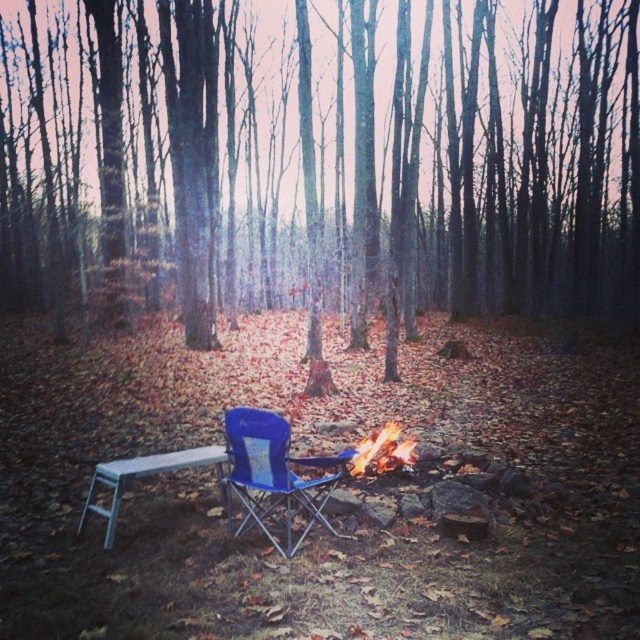
Question: Can you confirm if blue mesh folding chair at center is positioned to the right of flaming wood fire at center?

Choices:
 (A) no
 (B) yes

Answer: (A)

Question: Based on their relative distances, which object is farther from the smooth bark tree at center?

Choices:
 (A) flaming wood fire at center
 (B) blue mesh folding chair at center
 (C) metallic silver stool at lower left

Answer: (A)

Question: Which object is closer to the camera taking this photo?

Choices:
 (A) flaming wood fire at center
 (B) metallic silver stool at lower left
 (C) blue mesh folding chair at center
 (D) smooth bark tree at center

Answer: (C)

Question: Which is farther from the smooth bark tree at center?

Choices:
 (A) blue mesh folding chair at center
 (B) metallic silver stool at lower left

Answer: (B)

Question: Can you confirm if smooth bark tree at center is positioned to the right of flaming wood fire at center?

Choices:
 (A) no
 (B) yes

Answer: (A)

Question: Is metallic silver stool at lower left wider than flaming wood fire at center?

Choices:
 (A) no
 (B) yes

Answer: (B)